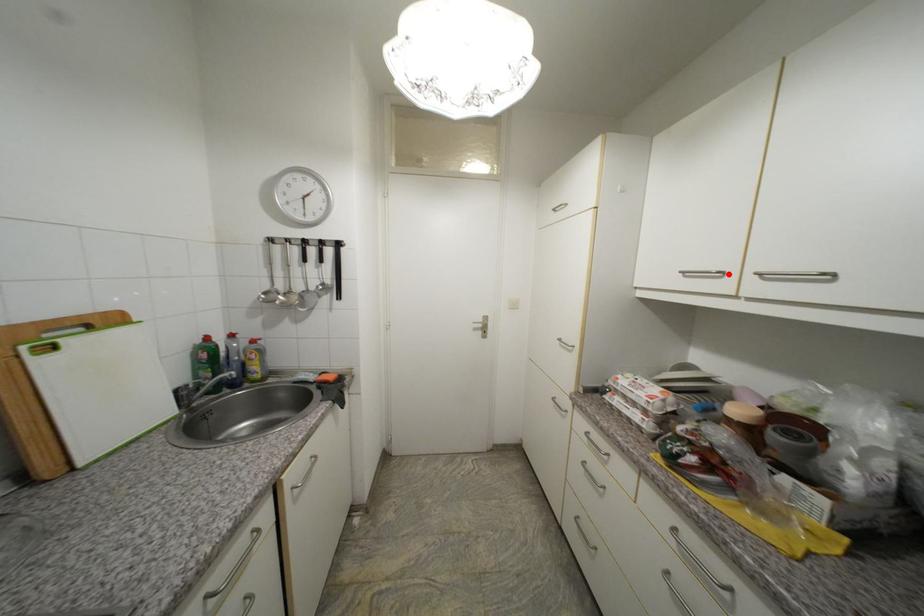
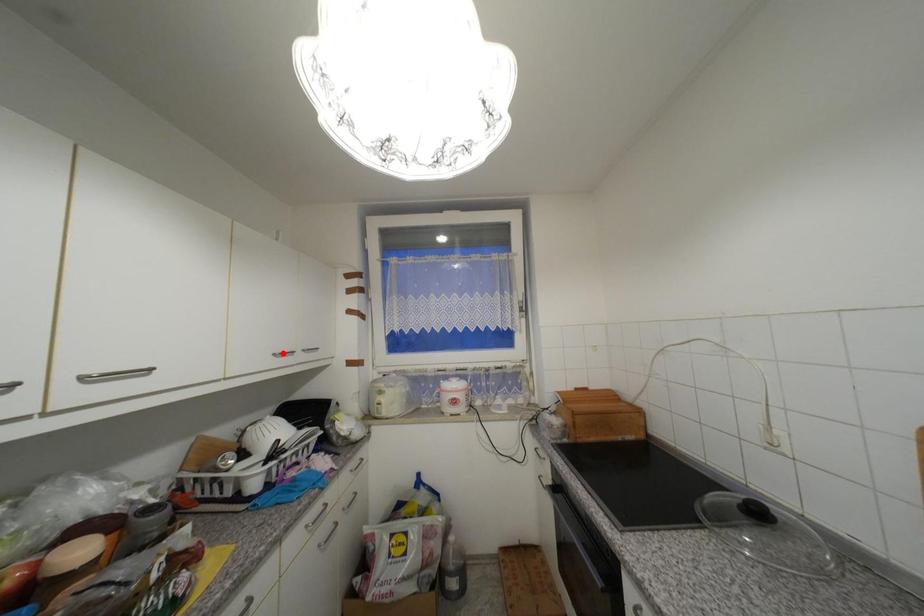
I am providing you with two images of the same scene from different viewpoints. A red point is marked on the first image and another point is marked on the second image. Are the points marked in image1 and image2 representing the same 3D position?

No